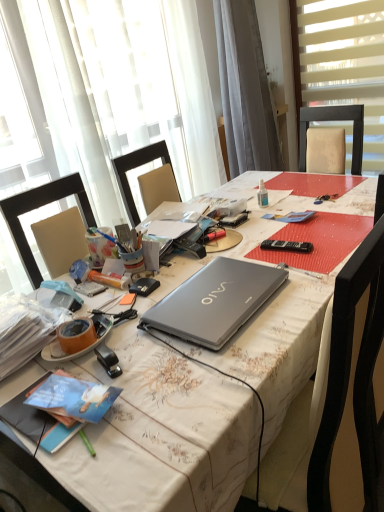
Where is `vacant space to the right of silver metallic laptop at center`? This screenshot has height=512, width=384. vacant space to the right of silver metallic laptop at center is located at coordinates (304, 280).